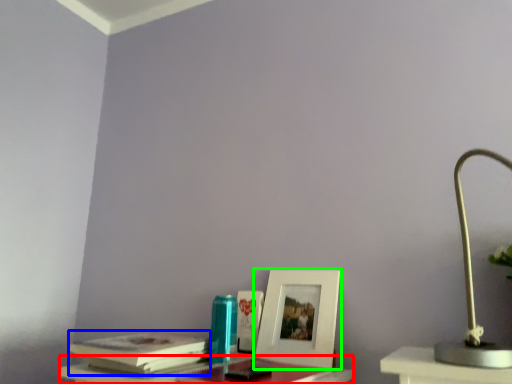
Question: Based on their relative distances, which object is farther from table (highlighted by a red box)? Choose from paperback book (highlighted by a blue box) and picture frame (highlighted by a green box).

Choices:
 (A) paperback book
 (B) picture frame

Answer: (B)